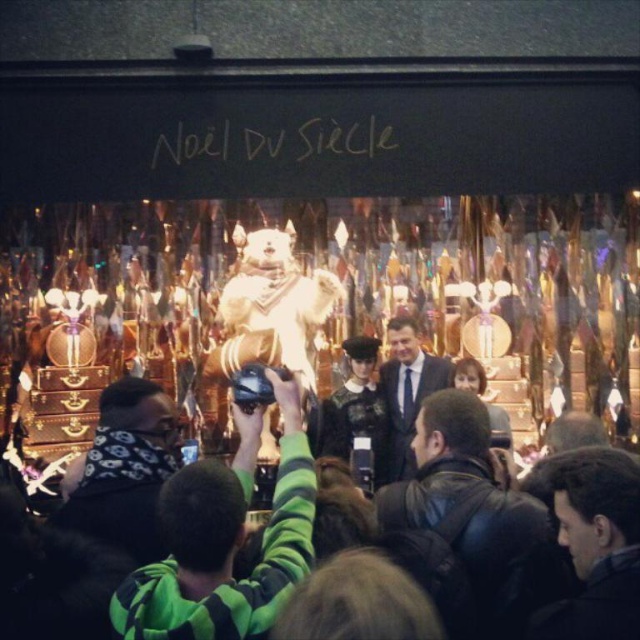
You are standing in front of the festive storefront with the text Noel Du Siecle displayed above the window. You notice a point marked at coordinates (x=355, y=284). What object is located at that point?

The white plush bear at center is located at point (x=355, y=284).

You are a photographer standing at the camera position. You want to take a closeup photo of the white plush bear at center. Based on the scene description, can you estimate whether you need to use a telephoto lens or a wide angle lens?

The white plush bear at center is 314.81 feet away from camera, so you need to use a telephoto lens to capture a closeup photo of it since it is far away.

You are a delivery person trying to place a new decoration in the storefront window. The decoration must be placed between the two points marked as point (x=509, y=200) and point (x=586, y=456). Since you can only place it in front of one of them, which point should you choose to ensure the decoration is visible from the street?

You should place the decoration in front of point (x=586, y=456) because point (x=509, y=200) is behind it, making the front point more visible to those outside the store.